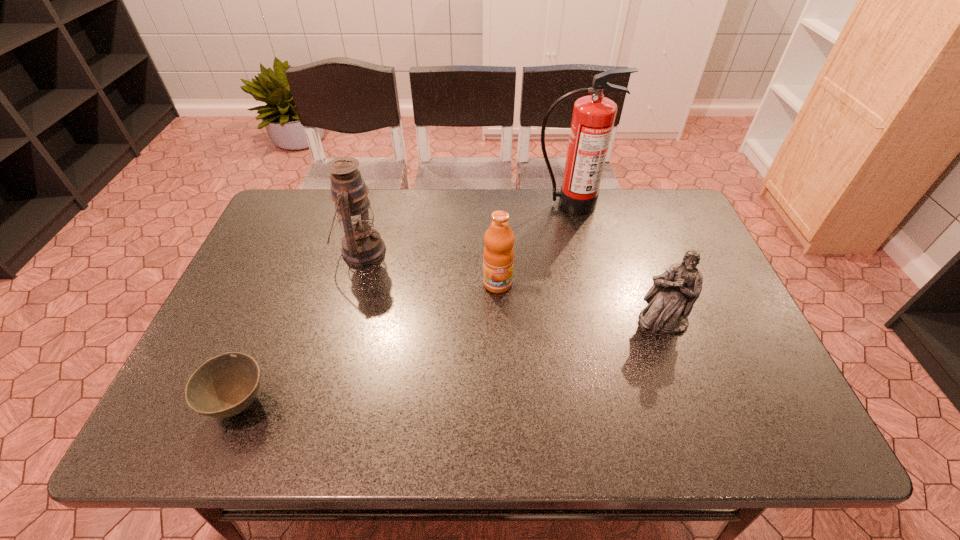
Locate an element on the screen. vacant space at the near edge of the desktop is located at coordinates (648, 442).

Where is `vacant space at the left edge of the desktop`? The width and height of the screenshot is (960, 540). vacant space at the left edge of the desktop is located at coordinates (257, 313).

The height and width of the screenshot is (540, 960). I want to click on free space at the right edge, so click(x=703, y=304).

At what (x,y) coordinates should I click in order to perform the action: click on vacant space at the far left corner of the desktop. Please return your answer as a coordinate pair (x, y). The image size is (960, 540). Looking at the image, I should click on (292, 206).

At what (x,y) coordinates should I click in order to perform the action: click on free space at the far right corner of the desktop. Please return your answer as a coordinate pair (x, y). The image size is (960, 540). Looking at the image, I should click on (664, 212).

The height and width of the screenshot is (540, 960). In order to click on free area in between the fire extinguisher and the fruit juice in this screenshot , I will do `click(534, 244)`.

Locate an element on the screen. free space between the figurine and the fourth object from right to left is located at coordinates (512, 286).

Find the location of a particular element. vacant space in between the fruit juice and the farthest object is located at coordinates (534, 244).

Find the location of `empty location between the bowl and the third object from left to right`. empty location between the bowl and the third object from left to right is located at coordinates (369, 343).

Locate an element on the screen. The width and height of the screenshot is (960, 540). unoccupied area between the fourth shortest object and the fruit juice is located at coordinates (429, 267).